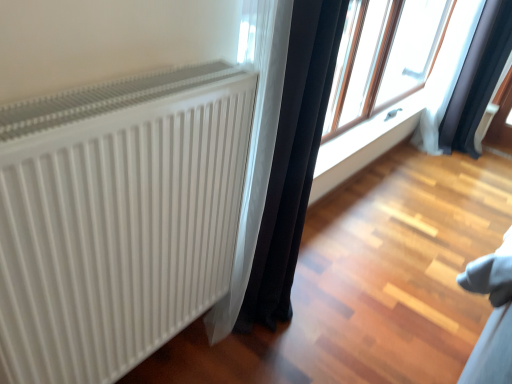
Question: From the image's perspective, is black fabric curtain at upper right, which ranks as the 1th curtain in back-to-front order, located above or below black fabric curtain at center, acting as the first curtain starting from the front?

Choices:
 (A) below
 (B) above

Answer: (B)

Question: Considering their positions, is black fabric curtain at upper right, the 2th curtain in the left-to-right sequence, located in front of or behind black fabric curtain at center, marked as the second curtain in a right-to-left arrangement?

Choices:
 (A) behind
 (B) front

Answer: (A)

Question: Estimate the real-world distances between objects in this image. Which object is closer to the transparent glass window at upper right?

Choices:
 (A) black fabric curtain at upper right, which ranks as the 1th curtain in back-to-front order
 (B) white ribbed radiator at left
 (C) white smooth window sill at center
 (D) black fabric curtain at center, marked as the second curtain in a right-to-left arrangement

Answer: (C)

Question: Estimate the real-world distances between objects in this image. Which object is closer to the transparent glass window at upper right?

Choices:
 (A) black fabric curtain at upper right, which ranks as the 1th curtain in back-to-front order
 (B) white ribbed radiator at left
 (C) white smooth window sill at center
 (D) black fabric curtain at center, acting as the first curtain starting from the left

Answer: (C)